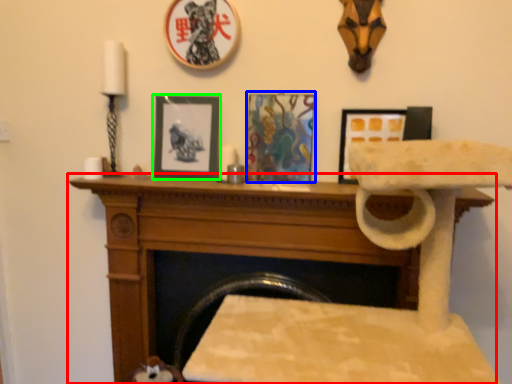
Question: Based on their relative distances, which object is nearer to furniture (highlighted by a red box)? Choose from picture frame (highlighted by a blue box) and picture frame (highlighted by a green box).

Choices:
 (A) picture frame
 (B) picture frame

Answer: (A)